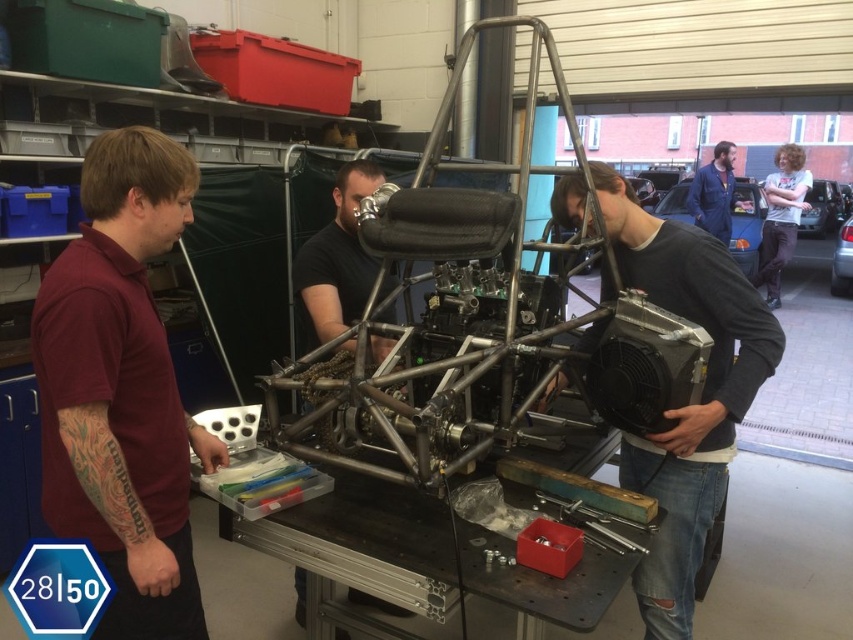
Is matte black radiator at center closer to the viewer compared to metallic red toolbox at center?

No, matte black radiator at center is behind metallic red toolbox at center.

How much distance is there between matte black radiator at center and metallic red toolbox at center?

matte black radiator at center is 15.87 inches away from metallic red toolbox at center.

Find the location of a particular element. The width and height of the screenshot is (853, 640). matte black radiator at center is located at coordinates (692, 403).

The width and height of the screenshot is (853, 640). In order to click on matte black radiator at center in this screenshot , I will do `click(692, 403)`.

Is point (682, 582) less distant than point (717, 234)?

Yes, point (682, 582) is in front of point (717, 234).

Does matte black radiator at center come behind blue denim jacket at upper right?

That is False.

Where is `matte black radiator at center`? matte black radiator at center is located at coordinates pyautogui.click(x=692, y=403).

Between point (140, 163) and point (677, 554), which one is positioned in front?

Point (140, 163) is in front.

Does maroon shirt at left come in front of matte black radiator at center?

Yes.

Does point (131, 525) come closer to viewer compared to point (573, 225)?

Yes.

You are a GUI agent. You are given a task and a screenshot of the screen. Output one action in this format:
    pyautogui.click(x=<x>, y=<y>)
    Task: Click on the maroon shirt at left
    
    Given the screenshot: What is the action you would take?
    pyautogui.click(x=122, y=388)